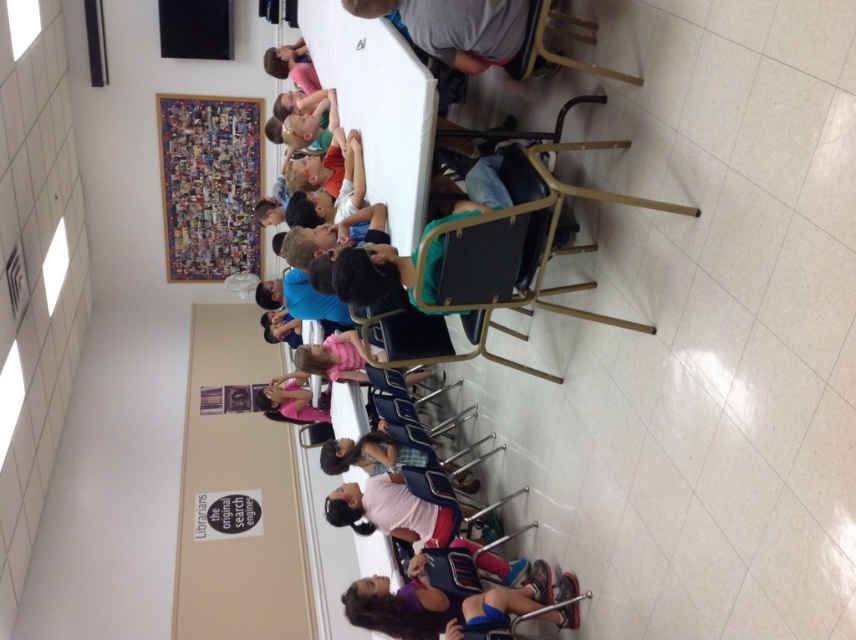
From the picture: You are a photographer taking a picture of the classroom scene. You notice the matte purple shirt at lower center and the pink fabric dress at center. Which clothing item is shorter in length?

The matte purple shirt at lower center is shorter than the pink fabric dress at center.

You are a photographer standing at the back of the room. You need to take a photo of the matte purple shirt at lower center and the pink fabric dress at center so that both are clearly visible. Given that your camera has a maximum focus range of 3 meters, will you be able to capture both subjects in focus at the same time?

The matte purple shirt at lower center is 2.88 meters from the pink fabric dress at center. Since the distance between them is within the camera maximum focus range of 3 meters, you can capture both subjects in focus at the same time.

You are standing in the classroom and want to reach the point marked at coordinates (535, 582). If you walk straight ahead, will you reach that point before the wall behind the children?

The point marked at coordinates (535, 582) is 3.49 meters from the viewer. Since the wall is behind the children and the children are seated facing forward, the distance to the wall would be greater than the distance to the point. Therefore, walking straight ahead would reach the point before the wall.